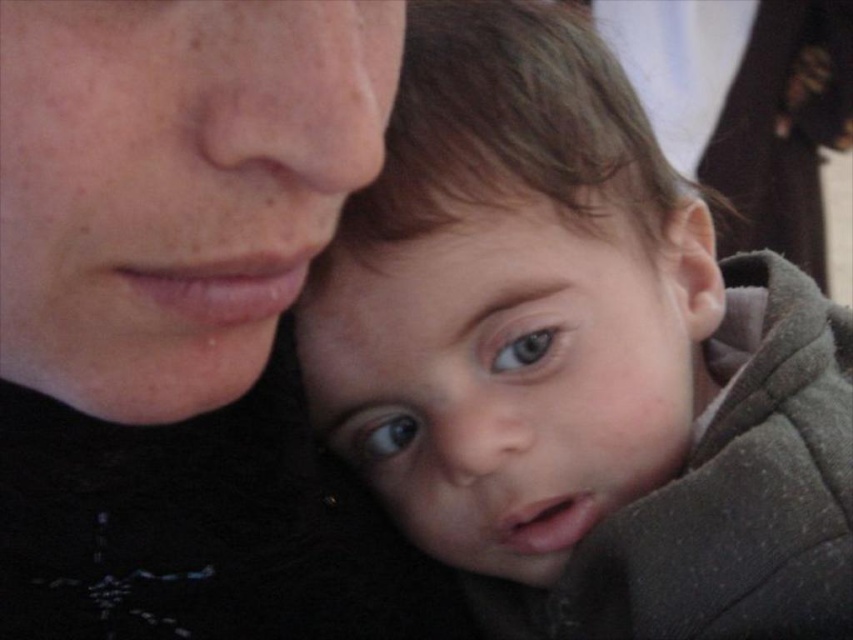
You are a photographer adjusting the camera settings to ensure both the matte black face at upper left and the green matte eye at center are in focus. Given that the camera can only focus on objects within a 10 cm width range, can both objects be in focus simultaneously?

The matte black face at upper left is wider than the green matte eye at center. Since the camera can focus on objects within a 10 cm width range, if the difference in their widths is less than 10 cm, they can be in focus. However, the exact dimensions aren

Based on the scene description, which eye has a larger width between the brown glossy eye at center and the green matte eye at center?

The brown glossy eye at center has a larger width than the green matte eye at center according to the description.